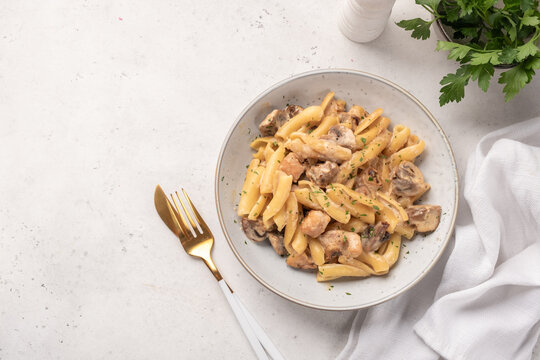
Image resolution: width=540 pixels, height=360 pixels. Identify the location of thin cutlery handle. (243, 324), (266, 338).